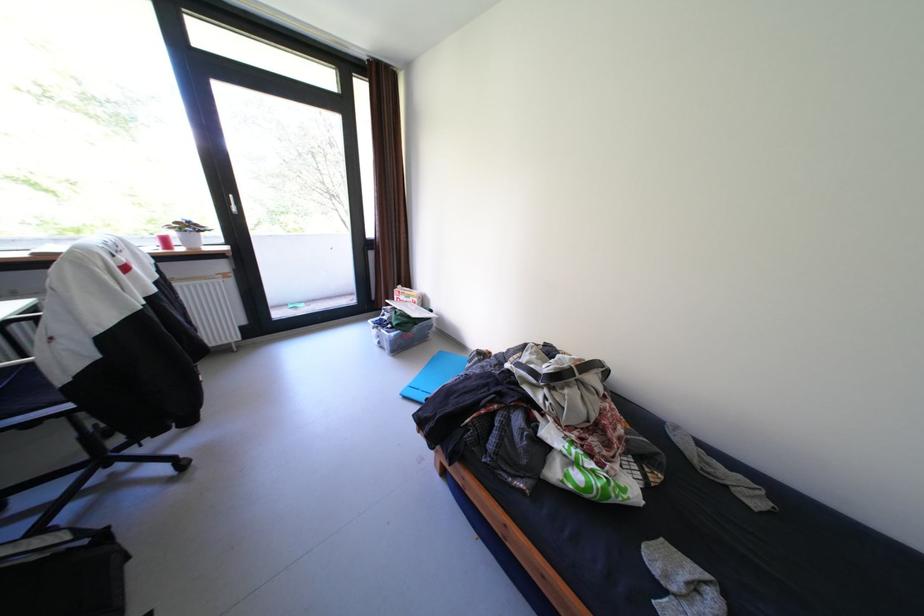
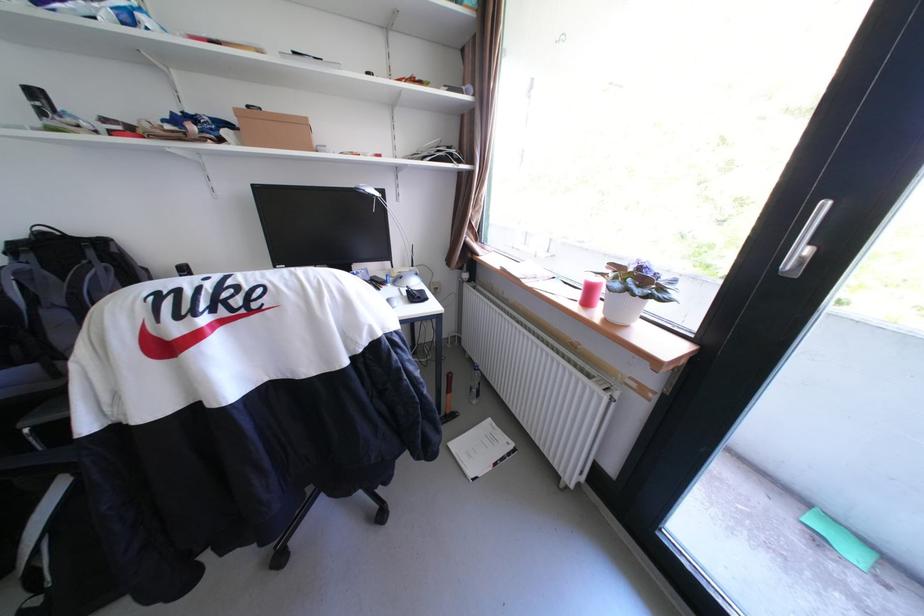
In the second image, find the point that corresponds to point (176, 240) in the first image.

(601, 291)